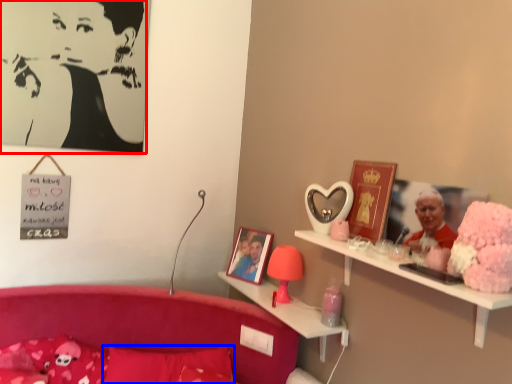
Question: Which object is closer to the camera taking this photo, person (highlighted by a red box) or pillow (highlighted by a blue box)?

Choices:
 (A) person
 (B) pillow

Answer: (B)